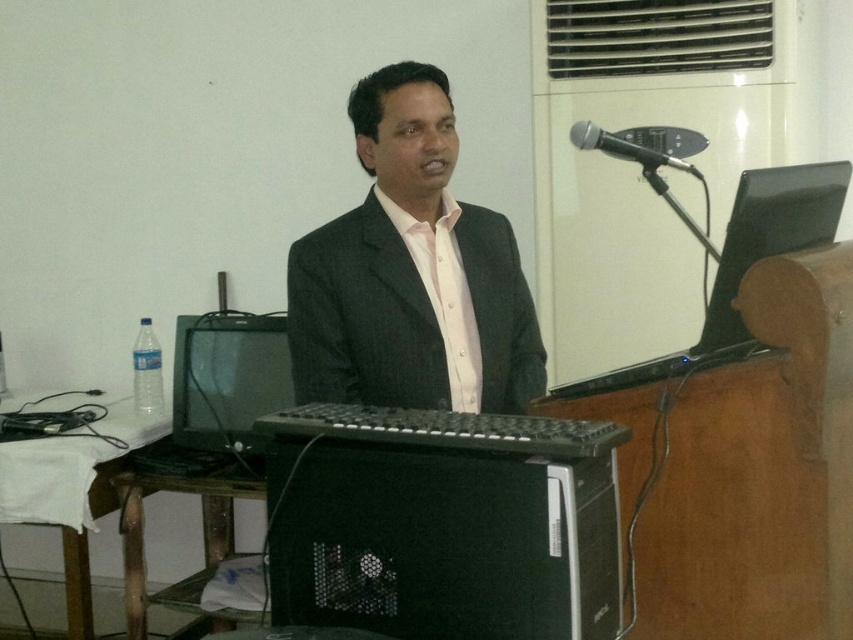
Is point (387, 92) positioned in front of point (769, 196)?

No.

Is matte black suit at center to the left of black plastic monitor at upper right from the viewer's perspective?

Indeed, matte black suit at center is positioned on the left side of black plastic monitor at upper right.

Does point (421, 161) lie behind point (717, 292)?

That is True.

Where is `matte black suit at center`? The image size is (853, 640). matte black suit at center is located at coordinates (410, 273).

Between point (485, 364) and point (589, 132), which one is positioned behind?

Point (485, 364)

Who is lower down, matte black suit at center or black metallic microphone at upper right?

matte black suit at center is below.

Which is in front, point (524, 408) or point (572, 125)?

Point (524, 408) is more forward.

Identify the location of matte black suit at center. Image resolution: width=853 pixels, height=640 pixels. (410, 273).

What are the coordinates of `black plastic monitor at upper right` in the screenshot? It's located at (769, 236).

Who is lower down, black plastic monitor at upper right or black metallic microphone at upper right?

Positioned lower is black plastic monitor at upper right.

Image resolution: width=853 pixels, height=640 pixels. What do you see at coordinates (769, 236) in the screenshot?
I see `black plastic monitor at upper right` at bounding box center [769, 236].

You are a GUI agent. You are given a task and a screenshot of the screen. Output one action in this format:
    pyautogui.click(x=<x>, y=<y>)
    Task: Click on the black plastic monitor at upper right
    The image size is (853, 640).
    Given the screenshot: What is the action you would take?
    pyautogui.click(x=769, y=236)